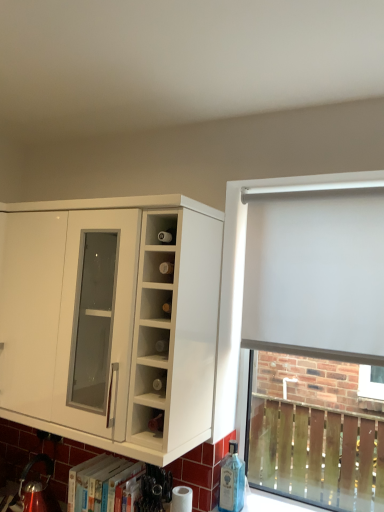
Question: From a real-world perspective, is white fabric curtain at right beneath white glossy cabinet at left?

Choices:
 (A) yes
 (B) no

Answer: (B)

Question: Does white fabric curtain at right have a larger size compared to white glossy cabinet at left?

Choices:
 (A) yes
 (B) no

Answer: (B)

Question: Are white fabric curtain at right and white glossy cabinet at left far apart?

Choices:
 (A) no
 (B) yes

Answer: (A)

Question: Does white fabric curtain at right appear on the right side of white glossy cabinet at left?

Choices:
 (A) yes
 (B) no

Answer: (A)

Question: Is white fabric curtain at right positioned with its back to white glossy cabinet at left?

Choices:
 (A) yes
 (B) no

Answer: (B)

Question: From the image's perspective, is white fabric curtain at right located beneath white glossy cabinet at left?

Choices:
 (A) yes
 (B) no

Answer: (B)

Question: Would you say white glossy cabinet at left is outside white matte roller blind at right?

Choices:
 (A) yes
 (B) no

Answer: (A)

Question: Would you say white matte roller blind at right is part of white glossy cabinet at left's contents?

Choices:
 (A) no
 (B) yes

Answer: (A)

Question: From the image's perspective, is white glossy cabinet at left on white matte roller blind at right?

Choices:
 (A) yes
 (B) no

Answer: (A)

Question: From the image's perspective, is white glossy cabinet at left located beneath white matte roller blind at right?

Choices:
 (A) no
 (B) yes

Answer: (A)

Question: Is white glossy cabinet at left next to white matte roller blind at right and touching it?

Choices:
 (A) yes
 (B) no

Answer: (B)

Question: Considering the relative sizes of white glossy cabinet at left and white matte roller blind at right in the image provided, is white glossy cabinet at left bigger than white matte roller blind at right?

Choices:
 (A) no
 (B) yes

Answer: (B)

Question: Considering the relative positions of white glossy cabinet at left and white fabric curtain at right in the image provided, is white glossy cabinet at left to the left of white fabric curtain at right from the viewer's perspective?

Choices:
 (A) no
 (B) yes

Answer: (B)